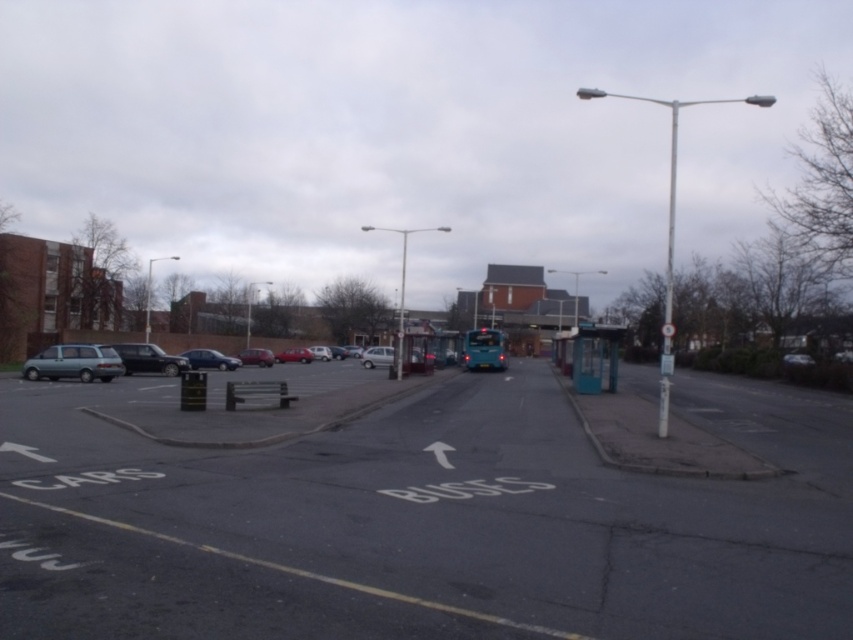
Question: Is black asphalt road at center in front of matte black car at center?

Choices:
 (A) no
 (B) yes

Answer: (B)

Question: Is matte green minivan at left thinner than matte black car at center?

Choices:
 (A) no
 (B) yes

Answer: (A)

Question: Which point is closer to the camera taking this photo?

Choices:
 (A) (169, 358)
 (B) (297, 348)
 (C) (24, 378)

Answer: (C)

Question: Considering the relative positions of black asphalt road at center and matte red car at center in the image provided, where is black asphalt road at center located with respect to matte red car at center?

Choices:
 (A) left
 (B) right

Answer: (B)

Question: Among these points, which one is nearest to the camera?

Choices:
 (A) (424, 432)
 (B) (299, 355)
 (C) (201, 358)
 (D) (27, 372)

Answer: (A)

Question: Estimate the real-world distances between objects in this image. Which object is closer to the teal plastic bus stop at right?

Choices:
 (A) shiny black car at left
 (B) metallic silver car at center-left

Answer: (A)